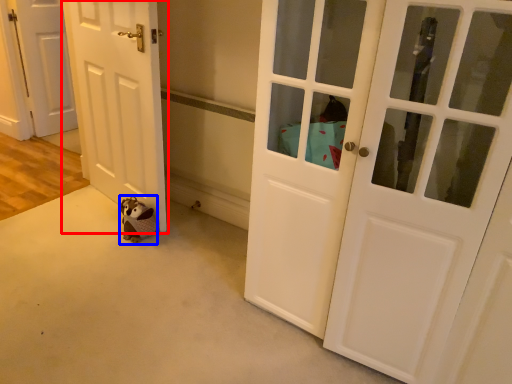
Question: Which of the following is the closest to the observer, door (highlighted by a red box) or animal (highlighted by a blue box)?

Choices:
 (A) door
 (B) animal

Answer: (A)